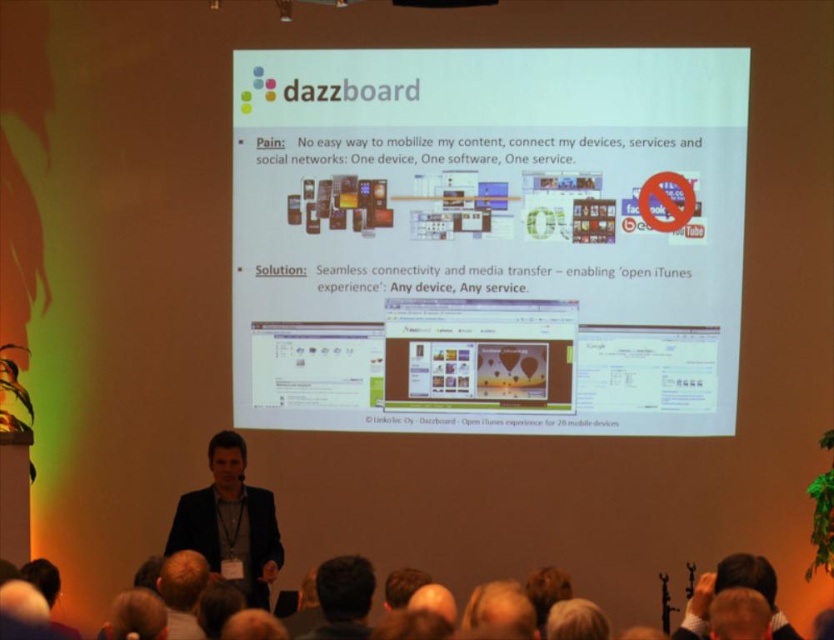
Does dark brown hair at lower center lie in front of black suit at center?

Yes, it is in front of black suit at center.

Does point (324, 595) come behind point (461, 1)?

No, it is in front of (461, 1).

The width and height of the screenshot is (834, 640). I want to click on dark brown hair at lower center, so click(x=343, y=596).

Does white glossy projector screen at center have a lesser height compared to dark brown hair at lower center?

In fact, white glossy projector screen at center may be taller than dark brown hair at lower center.

Is point (543, 211) less distant than point (335, 560)?

No.

Does point (551, 176) come in front of point (309, 634)?

No, it is behind (309, 634).

Find the location of `white glossy projector screen at center`. white glossy projector screen at center is located at coordinates (488, 240).

Locate an element on the screen. This screenshot has width=834, height=640. white glossy projector screen at center is located at coordinates (488, 240).

In the scene shown: Is white glossy projector screen at center thinner than black suit at center?

Incorrect, white glossy projector screen at center's width is not less than black suit at center's.

Between point (706, 390) and point (405, 1), which one is positioned in front?

Point (405, 1) is in front.

The image size is (834, 640). I want to click on white glossy projector screen at center, so point(488,240).